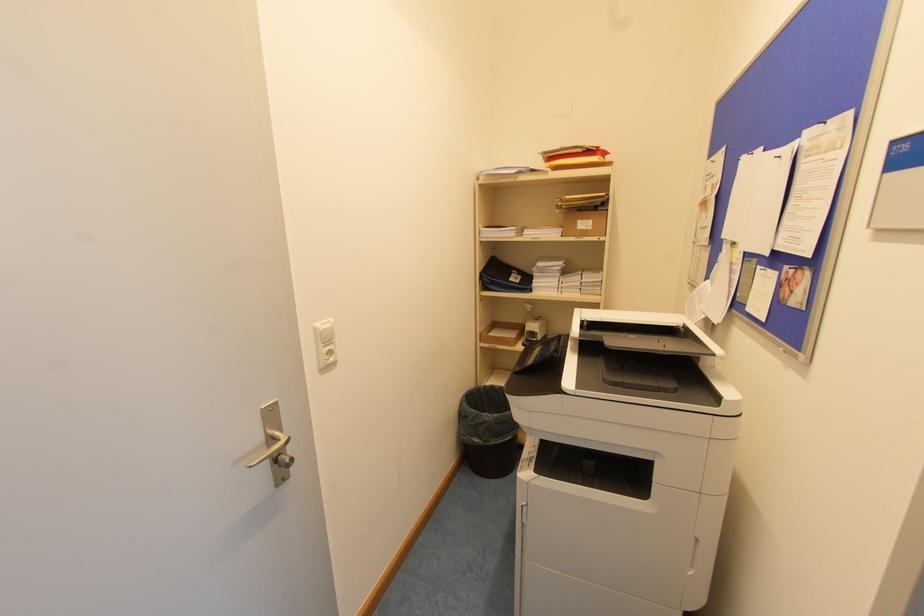
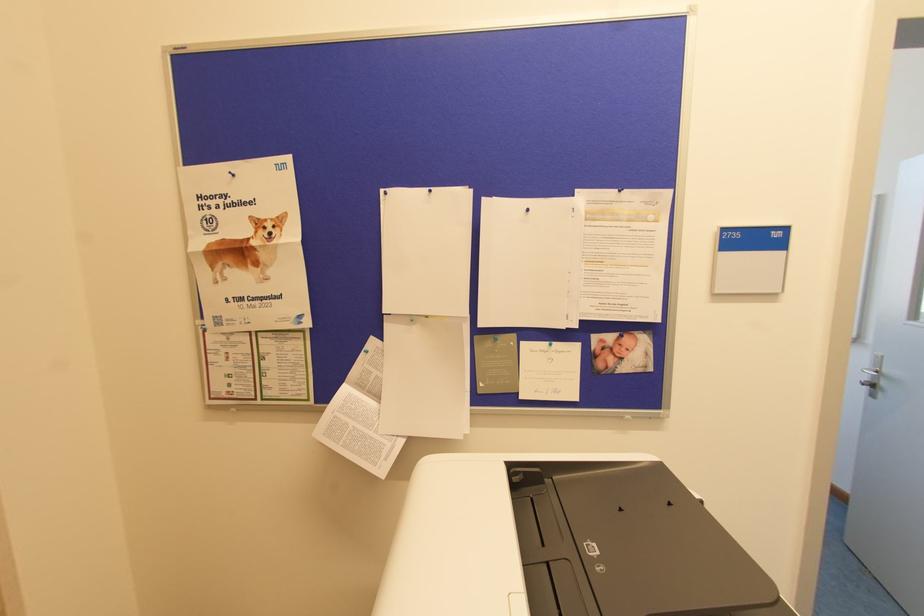
The point at (722, 237) is marked in the first image. Where is the corresponding point in the second image?

(383, 312)